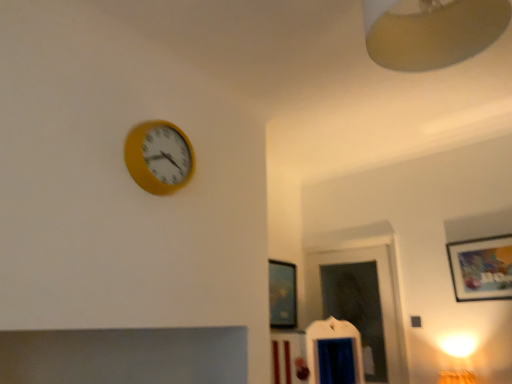
Question: Considering the relative sizes of matte black picture frame at center, the 1th picture frame in the left-to-right sequence, and yellow matte clock at upper left in the image provided, is matte black picture frame at center, the 1th picture frame in the left-to-right sequence, taller than yellow matte clock at upper left?

Choices:
 (A) no
 (B) yes

Answer: (B)

Question: Can you confirm if matte black picture frame at center, marked as the 2th picture frame in a right-to-left arrangement, is wider than yellow matte clock at upper left?

Choices:
 (A) no
 (B) yes

Answer: (A)

Question: Could you tell me if matte black picture frame at center, the 1th picture frame in the left-to-right sequence, is facing yellow matte clock at upper left?

Choices:
 (A) yes
 (B) no

Answer: (B)

Question: Can yellow matte clock at upper left be found inside matte black picture frame at center, marked as the 2th picture frame in a right-to-left arrangement?

Choices:
 (A) yes
 (B) no

Answer: (B)

Question: Can you confirm if matte black picture frame at center, which appears as the 2th picture frame when viewed from the front, is thinner than yellow matte clock at upper left?

Choices:
 (A) no
 (B) yes

Answer: (B)

Question: Which is correct: matte wooden picture frame at upper right, which ranks as the first picture frame in right-to-left order, is inside matte beige lampshade at upper right, or outside of it?

Choices:
 (A) outside
 (B) inside

Answer: (A)

Question: In terms of width, does matte wooden picture frame at upper right, which ranks as the first picture frame in right-to-left order, look wider or thinner when compared to matte beige lampshade at upper right?

Choices:
 (A) wide
 (B) thin

Answer: (B)

Question: From their relative heights in the image, would you say matte wooden picture frame at upper right, the 2th picture frame in the back-to-front sequence, is taller or shorter than matte beige lampshade at upper right?

Choices:
 (A) tall
 (B) short

Answer: (B)

Question: From a real-world perspective, is matte wooden picture frame at upper right, which is counted as the 1th picture frame, starting from the front, positioned above or below matte beige lampshade at upper right?

Choices:
 (A) below
 (B) above

Answer: (A)

Question: Considering their positions, is matte wooden picture frame at upper right, which ranks as the first picture frame in right-to-left order, located in front of or behind yellow matte clock at upper left?

Choices:
 (A) front
 (B) behind

Answer: (B)

Question: In the image, is matte wooden picture frame at upper right, which is counted as the 1th picture frame, starting from the front, on the left side or the right side of yellow matte clock at upper left?

Choices:
 (A) right
 (B) left

Answer: (A)

Question: Is matte wooden picture frame at upper right, which ranks as the first picture frame in right-to-left order, taller or shorter than yellow matte clock at upper left?

Choices:
 (A) tall
 (B) short

Answer: (A)

Question: From a real-world perspective, relative to yellow matte clock at upper left, is matte wooden picture frame at upper right, which ranks as the first picture frame in right-to-left order, vertically above or below?

Choices:
 (A) below
 (B) above

Answer: (A)

Question: From a real-world perspective, is matte beige lampshade at upper right physically located above or below matte wooden picture frame at upper right, the second picture frame when ordered from left to right?

Choices:
 (A) above
 (B) below

Answer: (A)

Question: Is point (395, 61) positioned closer to the camera than point (456, 244)?

Choices:
 (A) closer
 (B) farther

Answer: (A)